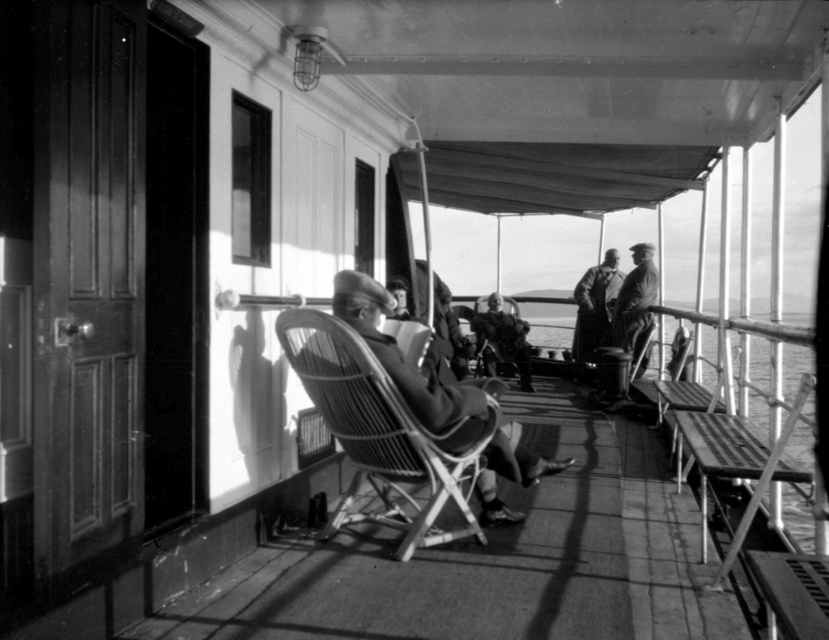
Question: Which of the following is the closest to the observer?

Choices:
 (A) (589, 332)
 (B) (389, 288)
 (C) (463, 476)

Answer: (C)

Question: Can you confirm if smooth leather hat at center is bigger than coarse wool coat at center?

Choices:
 (A) no
 (B) yes

Answer: (B)

Question: Does woven wood chair at center have a greater width compared to smooth leather hat at center?

Choices:
 (A) no
 (B) yes

Answer: (A)

Question: Which of the following is the closest to the observer?

Choices:
 (A) coarse wool coat at center
 (B) smooth leather hat at center

Answer: (B)

Question: Is woven wood chair at center below smooth leather hat at center?

Choices:
 (A) yes
 (B) no

Answer: (A)

Question: Among these points, which one is nearest to the camera?

Choices:
 (A) (604, 321)
 (B) (500, 460)

Answer: (B)